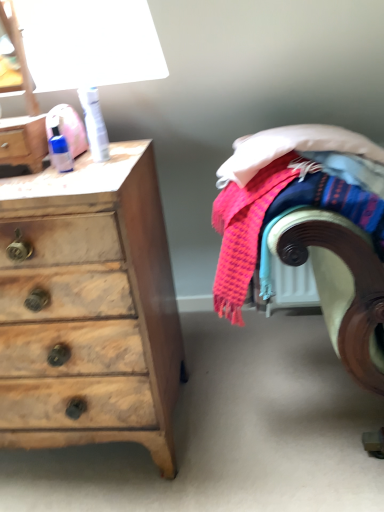
Locate an element on the screen. The image size is (384, 512). blue plastic bottle at upper left, marked as the 1th toiletry in a left-to-right arrangement is located at coordinates (59, 148).

Image resolution: width=384 pixels, height=512 pixels. I want to click on matte plastic bottle at upper left, so click(23, 141).

What do you see at coordinates (94, 123) in the screenshot? This screenshot has width=384, height=512. I see `white plastic can at upper left, placed as the first toiletry when sorted from right to left` at bounding box center [94, 123].

I want to click on blue plastic bottle at upper left, marked as the 1th toiletry in a left-to-right arrangement, so click(x=59, y=148).

Is matte plastic bottle at upper left looking in the opposite direction of blue plastic bottle at upper left, marked as the 1th toiletry in a left-to-right arrangement?

No.

From the image's perspective, which is below, matte plastic bottle at upper left or blue plastic bottle at upper left, which is counted as the 2th toiletry, starting from the right?

blue plastic bottle at upper left, which is counted as the 2th toiletry, starting from the right, is shown below in the image.

From the matte plastic bottle at upper left, count 1st toiletrys backward and point to it. Please provide its 2D coordinates.

[(59, 148)]

Is matte plastic bottle at upper left not inside blue plastic bottle at upper left, which is counted as the 2th toiletry, starting from the right?

matte plastic bottle at upper left is positioned outside blue plastic bottle at upper left, which is counted as the 2th toiletry, starting from the right.

This screenshot has height=512, width=384. Identify the location of the chest of drawers beneath the textured woolen blanket at right (from a real-world perspective). point(90,308).

Does wooden chest of drawers at left have a smaller size compared to textured woolen blanket at right?

Actually, wooden chest of drawers at left might be larger than textured woolen blanket at right.

Does blue plastic bottle at upper left, marked as the 1th toiletry in a left-to-right arrangement, have a lesser width compared to matte plastic bottle at upper left?

Yes, blue plastic bottle at upper left, marked as the 1th toiletry in a left-to-right arrangement, is thinner than matte plastic bottle at upper left.

Is point (66, 157) closer or farther from the camera than point (28, 139)?

Clearly, point (66, 157) is more distant from the camera than point (28, 139).

Which is more to the left, blue plastic bottle at upper left, which is counted as the 2th toiletry, starting from the right, or matte plastic bottle at upper left?

matte plastic bottle at upper left is more to the left.

In terms of width, does white plastic can at upper left, placed as the first toiletry when sorted from right to left, look wider or thinner when compared to blue plastic bottle at upper left, marked as the 1th toiletry in a left-to-right arrangement?

In the image, white plastic can at upper left, placed as the first toiletry when sorted from right to left, appears to be wider than blue plastic bottle at upper left, marked as the 1th toiletry in a left-to-right arrangement.

Is white plastic can at upper left, placed as the first toiletry when sorted from right to left, next to blue plastic bottle at upper left, which is counted as the 2th toiletry, starting from the right, and touching it?

No, white plastic can at upper left, placed as the first toiletry when sorted from right to left, is not making contact with blue plastic bottle at upper left, which is counted as the 2th toiletry, starting from the right.

Is white plastic can at upper left, placed as the first toiletry when sorted from right to left, outside of blue plastic bottle at upper left, marked as the 1th toiletry in a left-to-right arrangement?

Absolutely, white plastic can at upper left, placed as the first toiletry when sorted from right to left, is external to blue plastic bottle at upper left, marked as the 1th toiletry in a left-to-right arrangement.

In the image, is wooden chest of drawers at left on the left side or the right side of blue plastic bottle at upper left, marked as the 1th toiletry in a left-to-right arrangement?

Clearly, wooden chest of drawers at left is on the left of blue plastic bottle at upper left, marked as the 1th toiletry in a left-to-right arrangement, in the image.

From a real-world perspective, which object rests below the other?

In real-world perspective, wooden chest of drawers at left is lower.

Considering the sizes of wooden chest of drawers at left and blue plastic bottle at upper left, marked as the 1th toiletry in a left-to-right arrangement, in the image, is wooden chest of drawers at left bigger or smaller than blue plastic bottle at upper left, marked as the 1th toiletry in a left-to-right arrangement,?

Considering their sizes, wooden chest of drawers at left takes up more space than blue plastic bottle at upper left, marked as the 1th toiletry in a left-to-right arrangement.

Which object is closer to the camera, white plastic can at upper left, placed as the first toiletry when sorted from right to left, or wooden chest of drawers at left?

wooden chest of drawers at left is in front.

From the image's perspective, which is below, white plastic can at upper left, arranged as the second toiletry when viewed from the left, or wooden chest of drawers at left?

From the image's view, wooden chest of drawers at left is below.

Is white plastic can at upper left, placed as the first toiletry when sorted from right to left, positioned far away from wooden chest of drawers at left?

No, there isn't a large distance between white plastic can at upper left, placed as the first toiletry when sorted from right to left, and wooden chest of drawers at left.

Between white plastic can at upper left, placed as the first toiletry when sorted from right to left, and wooden chest of drawers at left, which one has less height?

white plastic can at upper left, placed as the first toiletry when sorted from right to left, is shorter.

Is textured woolen blanket at right facing away from blue plastic bottle at upper left, marked as the 1th toiletry in a left-to-right arrangement?

No, blue plastic bottle at upper left, marked as the 1th toiletry in a left-to-right arrangement, is not at the back of textured woolen blanket at right.

Is textured woolen blanket at right next to blue plastic bottle at upper left, marked as the 1th toiletry in a left-to-right arrangement, and touching it?

textured woolen blanket at right and blue plastic bottle at upper left, marked as the 1th toiletry in a left-to-right arrangement, are clearly separated.

Is blue plastic bottle at upper left, which is counted as the 2th toiletry, starting from the right, a part of textured woolen blanket at right?

Definitely not — blue plastic bottle at upper left, which is counted as the 2th toiletry, starting from the right, is not inside textured woolen blanket at right.

Considering the relative sizes of textured woolen blanket at right and blue plastic bottle at upper left, which is counted as the 2th toiletry, starting from the right, in the image provided, is textured woolen blanket at right wider than blue plastic bottle at upper left, which is counted as the 2th toiletry, starting from the right,?

Indeed, textured woolen blanket at right has a greater width compared to blue plastic bottle at upper left, which is counted as the 2th toiletry, starting from the right.

Where is `the 1st toiletry counting from the right side of the matte plastic bottle at upper left`? the 1st toiletry counting from the right side of the matte plastic bottle at upper left is located at coordinates (59, 148).

Find the location of `chest of drawers on the left of textured woolen blanket at right`. chest of drawers on the left of textured woolen blanket at right is located at coordinates (90, 308).

Which object lies nearer to the anchor point textured woolen blanket at right, blue plastic bottle at upper left, marked as the 1th toiletry in a left-to-right arrangement, or wooden chest of drawers at left?

wooden chest of drawers at left is closer to textured woolen blanket at right.

From the image, which object appears to be farther from wooden chest of drawers at left, matte plastic bottle at upper left or blue plastic bottle at upper left, which is counted as the 2th toiletry, starting from the right?

Based on the image, blue plastic bottle at upper left, which is counted as the 2th toiletry, starting from the right, appears to be further to wooden chest of drawers at left.

When comparing their distances from textured woolen blanket at right, does white plastic can at upper left, arranged as the second toiletry when viewed from the left, or wooden chest of drawers at left seem further?

white plastic can at upper left, arranged as the second toiletry when viewed from the left.

Looking at the image, which one is located further to matte plastic bottle at upper left, white plastic can at upper left, arranged as the second toiletry when viewed from the left, or blue plastic bottle at upper left, which is counted as the 2th toiletry, starting from the right?

white plastic can at upper left, arranged as the second toiletry when viewed from the left, lies further to matte plastic bottle at upper left than the other object.

Which object lies nearer to the anchor point wooden chest of drawers at left, blue plastic bottle at upper left, which is counted as the 2th toiletry, starting from the right, or textured woolen blanket at right?

Among the two, textured woolen blanket at right is located nearer to wooden chest of drawers at left.

Looking at the image, which one is located closer to white plastic can at upper left, placed as the first toiletry when sorted from right to left, textured woolen blanket at right or matte plastic bottle at upper left?

matte plastic bottle at upper left lies closer to white plastic can at upper left, placed as the first toiletry when sorted from right to left, than the other object.

Considering their positions, is blue plastic bottle at upper left, which is counted as the 2th toiletry, starting from the right, positioned further to matte plastic bottle at upper left than wooden chest of drawers at left?

The object further to matte plastic bottle at upper left is wooden chest of drawers at left.

When comparing their distances from white plastic can at upper left, arranged as the second toiletry when viewed from the left, does blue plastic bottle at upper left, marked as the 1th toiletry in a left-to-right arrangement, or matte plastic bottle at upper left seem closer?

Among the two, blue plastic bottle at upper left, marked as the 1th toiletry in a left-to-right arrangement, is located nearer to white plastic can at upper left, arranged as the second toiletry when viewed from the left.

I want to click on chest between white plastic can at upper left, arranged as the second toiletry when viewed from the left, and wooden chest of drawers at left in the up-down direction, so click(x=23, y=141).

Find the location of `toiletry located between matte plastic bottle at upper left and white plastic can at upper left, placed as the first toiletry when sorted from right to left, in the left-right direction`. toiletry located between matte plastic bottle at upper left and white plastic can at upper left, placed as the first toiletry when sorted from right to left, in the left-right direction is located at coordinates (59, 148).

The width and height of the screenshot is (384, 512). I want to click on toiletry between blue plastic bottle at upper left, marked as the 1th toiletry in a left-to-right arrangement, and textured woolen blanket at right from left to right, so click(94, 123).

Where is `toiletry between white plastic can at upper left, arranged as the second toiletry when viewed from the left, and wooden chest of drawers at left, in the vertical direction`? Image resolution: width=384 pixels, height=512 pixels. toiletry between white plastic can at upper left, arranged as the second toiletry when viewed from the left, and wooden chest of drawers at left, in the vertical direction is located at coordinates (59, 148).